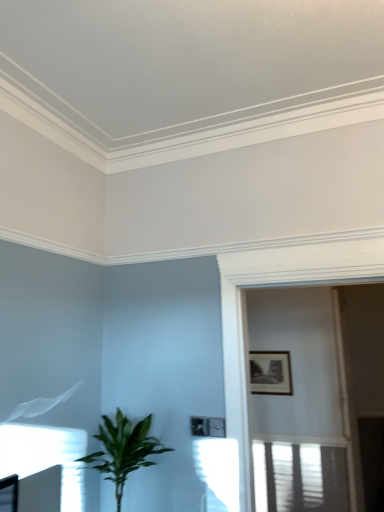
Question: Is white glossy screen door at upper center touching black matte picture frame at upper right?

Choices:
 (A) no
 (B) yes

Answer: (A)

Question: Does white glossy screen door at upper center have a lesser height compared to black matte picture frame at upper right?

Choices:
 (A) yes
 (B) no

Answer: (B)

Question: Is white glossy screen door at upper center to the right of black matte picture frame at upper right from the viewer's perspective?

Choices:
 (A) yes
 (B) no

Answer: (A)

Question: From a real-world perspective, is white glossy screen door at upper center below black matte picture frame at upper right?

Choices:
 (A) no
 (B) yes

Answer: (A)

Question: Could you tell me if white glossy screen door at upper center is turned towards black matte picture frame at upper right?

Choices:
 (A) no
 (B) yes

Answer: (A)

Question: From the image's perspective, is green leafy plant at lower left located above or below black matte picture frame at upper right?

Choices:
 (A) below
 (B) above

Answer: (A)

Question: In terms of height, does green leafy plant at lower left look taller or shorter compared to black matte picture frame at upper right?

Choices:
 (A) tall
 (B) short

Answer: (A)

Question: Considering the positions of green leafy plant at lower left and black matte picture frame at upper right in the image, is green leafy plant at lower left bigger or smaller than black matte picture frame at upper right?

Choices:
 (A) big
 (B) small

Answer: (A)

Question: Is point (117, 507) closer or farther from the camera than point (276, 379)?

Choices:
 (A) closer
 (B) farther

Answer: (A)

Question: From a real-world perspective, is white glossy screen door at upper center above or below green leafy plant at lower left?

Choices:
 (A) above
 (B) below

Answer: (A)

Question: Considering the positions of white glossy screen door at upper center and green leafy plant at lower left in the image, is white glossy screen door at upper center bigger or smaller than green leafy plant at lower left?

Choices:
 (A) big
 (B) small

Answer: (A)

Question: Is point (258, 324) closer or farther from the camera than point (99, 454)?

Choices:
 (A) closer
 (B) farther

Answer: (B)

Question: Visually, is white glossy screen door at upper center positioned to the left or to the right of green leafy plant at lower left?

Choices:
 (A) left
 (B) right

Answer: (B)

Question: Is white glossy screen door at upper center bigger or smaller than black matte picture frame at upper right?

Choices:
 (A) small
 (B) big

Answer: (B)

Question: From the image's perspective, is white glossy screen door at upper center positioned above or below black matte picture frame at upper right?

Choices:
 (A) below
 (B) above

Answer: (B)